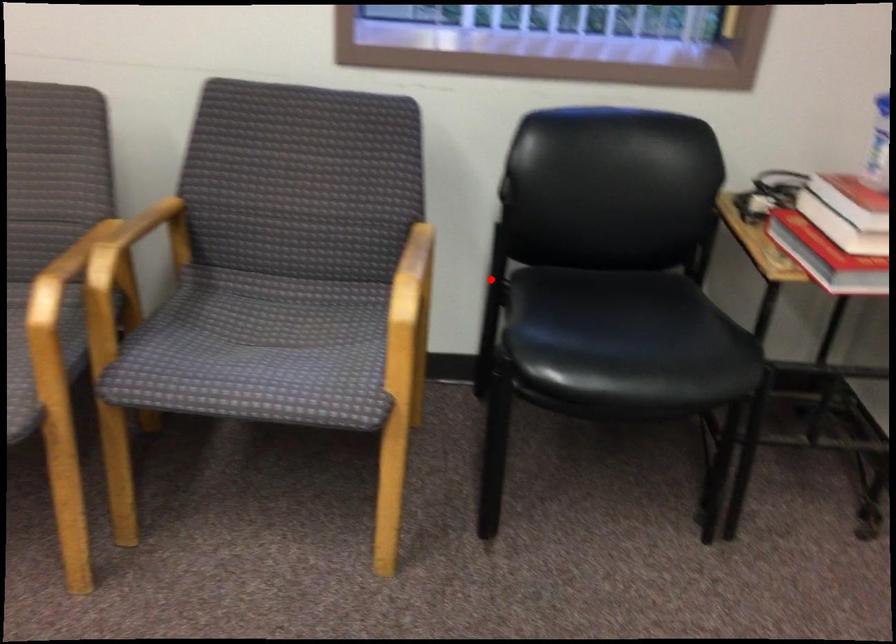
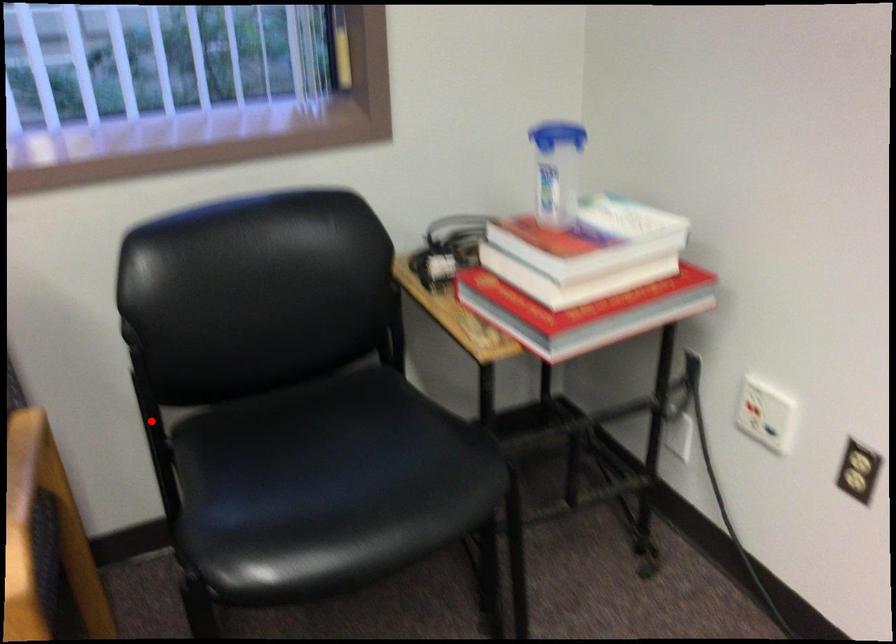
I am providing you with two images of the same scene from different viewpoints. A red point is marked on the first image and another point is marked on the second image. Is the red point in image1 aligned with the point shown in image2?

Yes